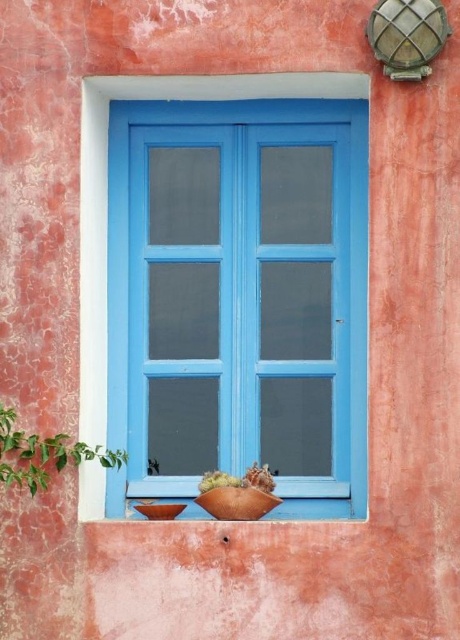
Who is lower down, green leafy plant at lower left or rustic terracotta pot at center?

rustic terracotta pot at center is lower down.

Based on the photo, does green leafy plant at lower left appear on the left side of rustic terracotta pot at center?

Indeed, green leafy plant at lower left is positioned on the left side of rustic terracotta pot at center.

Describe the element at coordinates (44, 454) in the screenshot. I see `green leafy plant at lower left` at that location.

Locate an element on the screen. The width and height of the screenshot is (460, 640). green leafy plant at lower left is located at coordinates (44, 454).

Who is lower down, blue painted wood window at center or rustic terracotta pot at center?

rustic terracotta pot at center is below.

You are a GUI agent. You are given a task and a screenshot of the screen. Output one action in this format:
    pyautogui.click(x=<x>, y=<y>)
    Task: Click on the blue painted wood window at center
    This screenshot has width=460, height=640.
    Given the screenshot: What is the action you would take?
    pyautogui.click(x=107, y=192)

This screenshot has height=640, width=460. I want to click on blue painted wood window at center, so click(x=107, y=192).

Is green leafy plant at lower left taller than matte brown pot at lower center?

Yes, green leafy plant at lower left is taller than matte brown pot at lower center.

Does point (80, 460) come behind point (264, 476)?

No.

What do you see at coordinates (44, 454) in the screenshot? I see `green leafy plant at lower left` at bounding box center [44, 454].

I want to click on green leafy plant at lower left, so click(44, 454).